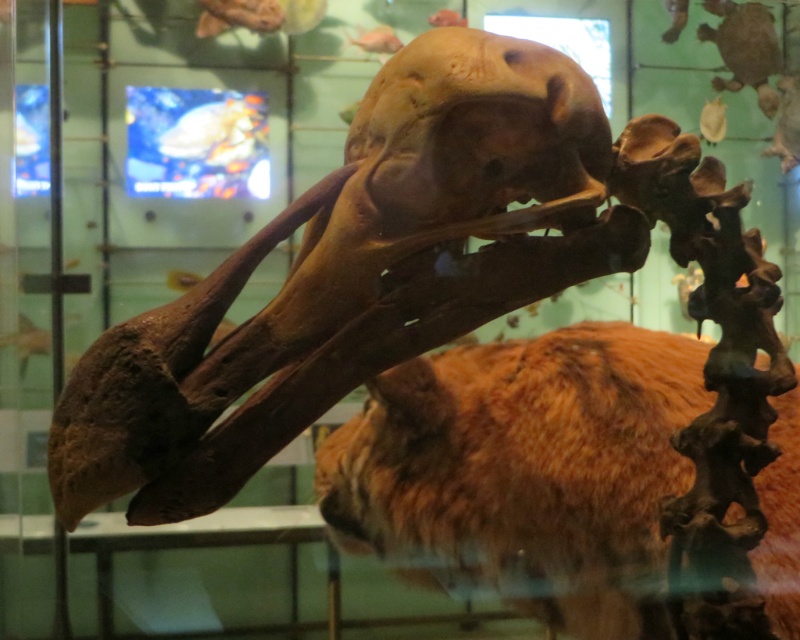
Question: Which of the following is the farthest from the observer?

Choices:
 (A) (606, 506)
 (B) (165, 470)
 (C) (424, 65)

Answer: (A)

Question: Estimate the real-world distances between objects in this image. Which object is farther from the brown matte skull at upper center?

Choices:
 (A) brown fuzzy fur at center
 (B) brown matte skull at center

Answer: (A)

Question: Where is brown matte skull at center located in relation to brown matte skull at upper center in the image?

Choices:
 (A) below
 (B) above

Answer: (A)

Question: Is brown fuzzy fur at center below brown matte skull at upper center?

Choices:
 (A) yes
 (B) no

Answer: (A)

Question: Which point is farther to the camera?

Choices:
 (A) (504, 522)
 (B) (542, 209)
 (C) (532, 154)

Answer: (A)

Question: Can you confirm if brown matte skull at center is positioned below brown fuzzy fur at center?

Choices:
 (A) no
 (B) yes

Answer: (A)